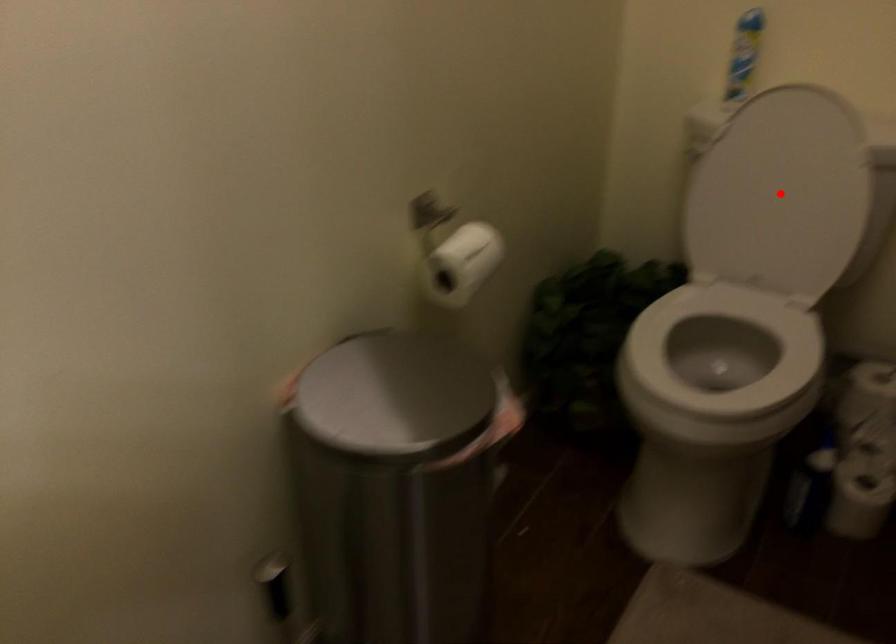
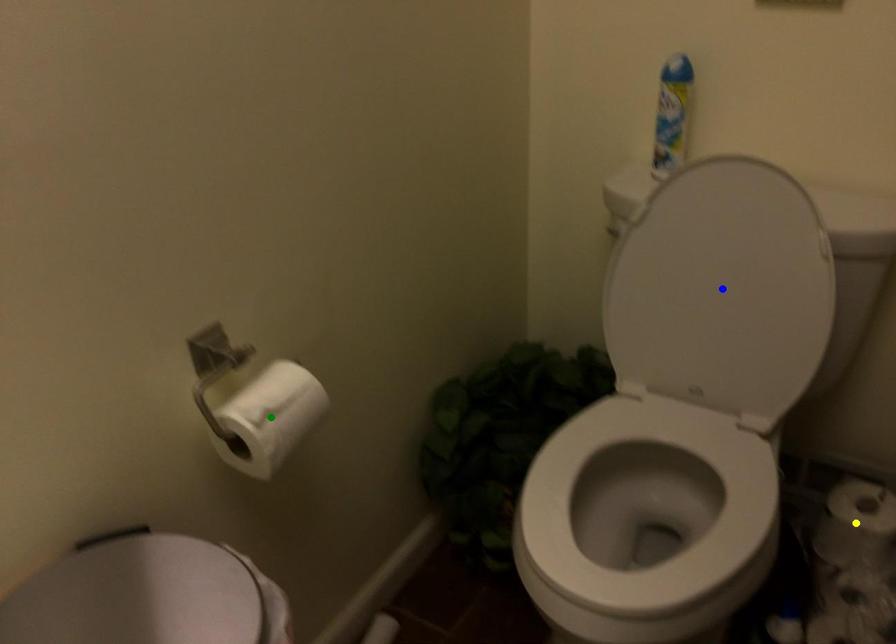
Question: I am providing you with two images of the same scene from different viewpoints. A red point is marked on the first image. You are given multiple points on the second image. Which mark in image 2 goes with the point in image 1?

Choices:
 (A) blue point
 (B) yellow point
 (C) green point

Answer: (A)